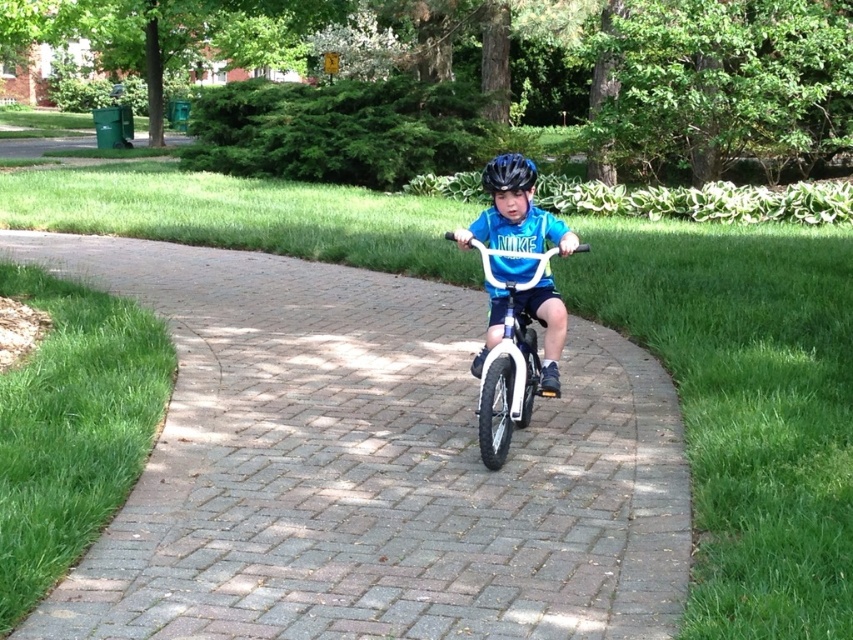
Between white matte bicycle at center and blue matte bicycle helmet at center, which one appears on the left side from the viewer's perspective?

Positioned to the left is white matte bicycle at center.

Is point (485, 275) in front of point (509, 186)?

No, (485, 275) is further to viewer.

I want to click on white matte bicycle at center, so click(x=509, y=360).

Is gray brick pavement at center bigger than blue matte bicycle helmet at center?

Actually, gray brick pavement at center might be smaller than blue matte bicycle helmet at center.

Which is more to the left, gray brick pavement at center or blue matte bicycle helmet at center?

From the viewer's perspective, gray brick pavement at center appears more on the left side.

The height and width of the screenshot is (640, 853). What do you see at coordinates (369, 467) in the screenshot? I see `gray brick pavement at center` at bounding box center [369, 467].

Where is `gray brick pavement at center`? gray brick pavement at center is located at coordinates [x=369, y=467].

Does blue matte helmet at center have a larger size compared to blue matte bicycle helmet at center?

No, blue matte helmet at center is not bigger than blue matte bicycle helmet at center.

Between point (521, 182) and point (534, 170), which one is positioned in front?

Point (521, 182) is more forward.

At what (x,y) coordinates should I click in order to perform the action: click on blue matte helmet at center. Please return your answer as a coordinate pair (x, y). The height and width of the screenshot is (640, 853). Looking at the image, I should click on (514, 211).